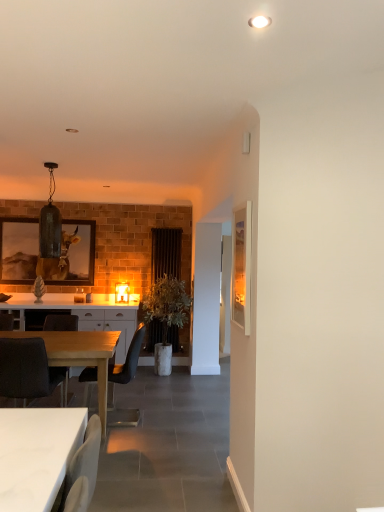
Measure the distance between black fabric chair at lower left, which ranks as the 1th chair in front-to-back order, and camera.

black fabric chair at lower left, which ranks as the 1th chair in front-to-back order, is 3.44 meters from camera.

Find the location of a particular element. Image resolution: width=384 pixels, height=512 pixels. white glossy table at lower left, the 2th desk from the left is located at coordinates (37, 454).

Describe the element at coordinates (166, 253) in the screenshot. The image size is (384, 512). I see `black fabric curtain at center` at that location.

What do you see at coordinates (48, 258) in the screenshot? I see `wooden framed artwork at left, placed as the 2th picture frame when sorted from right to left` at bounding box center [48, 258].

What do you see at coordinates (79, 355) in the screenshot?
I see `light wood table at lower left, the 1th desk positioned from the back` at bounding box center [79, 355].

Locate an element on the screen. This screenshot has height=512, width=384. black fabric chair at lower left, which ranks as the 1th chair in front-to-back order is located at coordinates (28, 370).

Is light wood table at lower left, marked as the second desk in a right-to-left arrangement, closer to the viewer compared to green leafy plant in white pot at center?

Yes, light wood table at lower left, marked as the second desk in a right-to-left arrangement, is in front of green leafy plant in white pot at center.

Is light wood table at lower left, which is counted as the first desk, starting from the left, far away from green leafy plant in white pot at center?

Yes, light wood table at lower left, which is counted as the first desk, starting from the left, and green leafy plant in white pot at center are located far from each other.

Considering the relative sizes of light wood table at lower left, marked as the second desk in a right-to-left arrangement, and green leafy plant in white pot at center in the image provided, is light wood table at lower left, marked as the second desk in a right-to-left arrangement, taller than green leafy plant in white pot at center?

Incorrect, the height of light wood table at lower left, marked as the second desk in a right-to-left arrangement, is not larger of that of green leafy plant in white pot at center.

Does dark gray fabric chair at lower left, which is the 1th chair in back-to-front order, turn towards matte glass pendant light at upper left, which appears as the 2th lamp when viewed from the right?

No, dark gray fabric chair at lower left, which is the 1th chair in back-to-front order, is not oriented towards matte glass pendant light at upper left, which appears as the 2th lamp when viewed from the right.

Considering the points (70, 327) and (48, 206), which point is behind, point (70, 327) or point (48, 206)?

Point (70, 327)

Is the surface of dark gray fabric chair at lower left, which is the 1th chair in back-to-front order, in direct contact with matte glass pendant light at upper left, positioned as the 2th lamp in back-to-front order?

No, dark gray fabric chair at lower left, which is the 1th chair in back-to-front order, is not with matte glass pendant light at upper left, positioned as the 2th lamp in back-to-front order.

How distant is dark gray fabric chair at lower left, which is the 1th chair in back-to-front order, from matte glass pendant light at upper left, the 1th lamp viewed from the front?

dark gray fabric chair at lower left, which is the 1th chair in back-to-front order, and matte glass pendant light at upper left, the 1th lamp viewed from the front, are 91.49 centimeters apart.

From a real-world perspective, relative to light wood table at lower left, the 1th desk positioned from the back, is wooden framed artwork at left, positioned as the 1th picture frame in back-to-front order, vertically above or below?

In terms of real-world spatial position, wooden framed artwork at left, positioned as the 1th picture frame in back-to-front order, is above light wood table at lower left, the 1th desk positioned from the back.

Is light wood table at lower left, which is counted as the first desk, starting from the left, at the back of wooden framed artwork at left, placed as the 1th picture frame when sorted from left to right?

No, wooden framed artwork at left, placed as the 1th picture frame when sorted from left to right, is not facing the opposite direction of light wood table at lower left, which is counted as the first desk, starting from the left.

I want to click on picture frame lying behind the light wood table at lower left, the 1th desk positioned from the back, so click(x=48, y=258).

How much distance is there between matte glass pendant light at upper left, which ranks as the 1th lamp in top-to-bottom order, and light wood table at lower left, the 1th desk positioned from the back?

matte glass pendant light at upper left, which ranks as the 1th lamp in top-to-bottom order, is 1.01 meters from light wood table at lower left, the 1th desk positioned from the back.

From the image's perspective, would you say matte glass pendant light at upper left, which ranks as the 1th lamp in top-to-bottom order, is shown under light wood table at lower left, which is the second desk from front to back?

No, from the image's perspective, matte glass pendant light at upper left, which ranks as the 1th lamp in top-to-bottom order, is not beneath light wood table at lower left, which is the second desk from front to back.

Does matte glass pendant light at upper left, which is the 1th lamp from left to right, have a lesser width compared to light wood table at lower left, marked as the second desk in a right-to-left arrangement?

Yes, matte glass pendant light at upper left, which is the 1th lamp from left to right, is thinner than light wood table at lower left, marked as the second desk in a right-to-left arrangement.

From the image's perspective, which lamp is the 2nd one above the light wood table at lower left, which is counted as the first desk, starting from the left? Please provide its 2D coordinates.

[(50, 223)]

Between dark gray fabric chair at lower left, which is the 1th chair in back-to-front order, and black fabric curtain at center, which one has more height?

With more height is black fabric curtain at center.

From the image's perspective, between dark gray fabric chair at lower left, which ranks as the 3th chair in front-to-back order, and black fabric curtain at center, who is located below?

dark gray fabric chair at lower left, which ranks as the 3th chair in front-to-back order, from the image's perspective.

From a real-world perspective, between dark gray fabric chair at lower left, which ranks as the 3th chair in front-to-back order, and black fabric curtain at center, who is vertically lower?

dark gray fabric chair at lower left, which ranks as the 3th chair in front-to-back order, is physically lower.

Between dark gray fabric chair at lower left, which is the 1th chair in back-to-front order, and black fabric curtain at center, which one appears on the left side from the viewer's perspective?

From the viewer's perspective, dark gray fabric chair at lower left, which is the 1th chair in back-to-front order, appears more on the left side.

Is wooden framed artwork at left, placed as the second picture frame when sorted from front to back, shorter than black fabric chair at lower left, which ranks as the 1th chair in front-to-back order?

No, wooden framed artwork at left, placed as the second picture frame when sorted from front to back, is not shorter than black fabric chair at lower left, which ranks as the 1th chair in front-to-back order.

Which object is thinner, wooden framed artwork at left, positioned as the 1th picture frame in back-to-front order, or black fabric chair at lower left, which ranks as the 1th chair in front-to-back order?

wooden framed artwork at left, positioned as the 1th picture frame in back-to-front order.

Does point (18, 264) lie behind point (54, 382)?

Yes, point (18, 264) is behind point (54, 382).

Is wooden framed artwork at left, positioned as the 1th picture frame in back-to-front order, outside of black fabric chair at lower left, positioned as the third chair in back-to-front order?

Yes, wooden framed artwork at left, positioned as the 1th picture frame in back-to-front order, is outside of black fabric chair at lower left, positioned as the third chair in back-to-front order.

Between matte glass lampshade at center, which is counted as the first lamp, starting from the right, and black fabric curtain at center, which one has smaller size?

matte glass lampshade at center, which is counted as the first lamp, starting from the right.

From the image's perspective, relative to black fabric curtain at center, is matte glass lampshade at center, which is the 1th lamp in back-to-front order, above or below?

matte glass lampshade at center, which is the 1th lamp in back-to-front order, is below black fabric curtain at center.

Relative to black fabric curtain at center, is matte glass lampshade at center, the 2th lamp positioned from the left, in front or behind?

In the image, matte glass lampshade at center, the 2th lamp positioned from the left, appears in front of black fabric curtain at center.

You are a GUI agent. You are given a task and a screenshot of the screen. Output one action in this format:
    pyautogui.click(x=<x>, y=<y>)
    Task: Click on the desk below the green leafy plant in white pot at center (from the image's perspective)
    The width and height of the screenshot is (384, 512).
    Given the screenshot: What is the action you would take?
    pyautogui.click(x=79, y=355)

There is a matte glass pendant light at upper left, the second lamp when ordered from bottom to top. At what (x,y) coordinates should I click in order to perform the action: click on the 3rd chair below it (from a real-world perspective). Please return your answer as a coordinate pair (x, y). Image resolution: width=384 pixels, height=512 pixels. Looking at the image, I should click on (60, 322).

Looking at the image, which one is located closer to matte glass pendant light at upper left, which is the 1th lamp from left to right, black fabric chair at lower left, positioned as the third chair in back-to-front order, or dark gray fabric chair at lower left, which ranks as the 3th chair in front-to-back order?

Based on the image, dark gray fabric chair at lower left, which ranks as the 3th chair in front-to-back order, appears to be nearer to matte glass pendant light at upper left, which is the 1th lamp from left to right.

From the image, which object appears to be farther from white glossy table at lower left, placed as the first desk when sorted from front to back, matte black chair at center, marked as the 2th chair in a back-to-front arrangement, or black fabric chair at lower left, positioned as the third chair in back-to-front order?

matte black chair at center, marked as the 2th chair in a back-to-front arrangement.

From the image, which object appears to be farther from green leafy plant in white pot at center, white glossy cabinet at center or matte black chair at center, marked as the second chair in a front-to-back arrangement?

white glossy cabinet at center lies further to green leafy plant in white pot at center than the other object.

Considering their positions, is white glossy cabinet at center positioned closer to matte glass pendant light at upper left, positioned as the 2th lamp in back-to-front order, than black fabric curtain at center?

white glossy cabinet at center is closer to matte glass pendant light at upper left, positioned as the 2th lamp in back-to-front order.

From the image, which object appears to be farther from black fabric chair at lower left, positioned as the third chair in back-to-front order, matte black chair at center, marked as the 2th chair in a back-to-front arrangement, or wooden framed artwork at left, positioned as the 1th picture frame in back-to-front order?

Among the two, wooden framed artwork at left, positioned as the 1th picture frame in back-to-front order, is located further to black fabric chair at lower left, positioned as the third chair in back-to-front order.

From the image, which object appears to be nearer to matte glass pendant light at upper left, which is the 1th lamp from left to right, green leafy plant in white pot at center or wooden framed artwork at left, placed as the 2th picture frame when sorted from right to left?

Among the two, wooden framed artwork at left, placed as the 2th picture frame when sorted from right to left, is located nearer to matte glass pendant light at upper left, which is the 1th lamp from left to right.

Looking at the image, which one is located further to green leafy plant in white pot at center, matte glass lampshade at center, which is the 1th lamp in back-to-front order, or matte black chair at center, marked as the 2th chair in a back-to-front arrangement?

Among the two, matte black chair at center, marked as the 2th chair in a back-to-front arrangement, is located further to green leafy plant in white pot at center.

From the image, which object appears to be nearer to wooden framed artwork at left, positioned as the 1th picture frame in back-to-front order, light wood table at lower left, which is counted as the first desk, starting from the left, or white glossy cabinet at center?

white glossy cabinet at center is positioned closer to the anchor wooden framed artwork at left, positioned as the 1th picture frame in back-to-front order.

This screenshot has width=384, height=512. I want to click on desk located between white glossy table at lower left, the 2th desk from the left, and matte glass pendant light at upper left, which ranks as the 1th lamp in top-to-bottom order, in the depth direction, so click(x=79, y=355).

This screenshot has width=384, height=512. I want to click on lamp positioned between white glossy table at lower left, the 1th desk positioned from the right, and white glossy cabinet at center from near to far, so click(x=50, y=223).

You are a GUI agent. You are given a task and a screenshot of the screen. Output one action in this format:
    pyautogui.click(x=<x>, y=<y>)
    Task: Click on the curtain positioned between wooden picture frame at right, the 1th picture frame in the front-to-back sequence, and wooden framed artwork at left, placed as the 1th picture frame when sorted from left to right, from near to far
    Image resolution: width=384 pixels, height=512 pixels.
    Given the screenshot: What is the action you would take?
    pyautogui.click(x=166, y=253)

Identify the location of lamp between matte black chair at center, marked as the 2th chair in a back-to-front arrangement, and matte glass lampshade at center, the 2th lamp positioned from the left, along the z-axis. (50, 223).